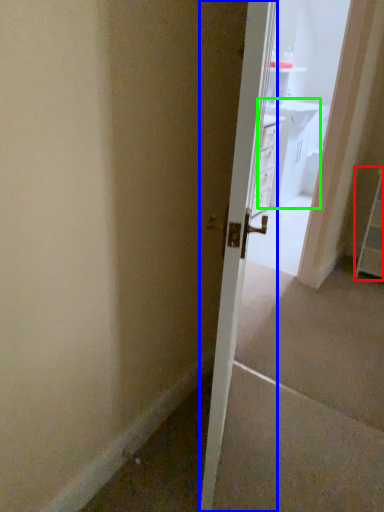
Question: Which is farther away from dresser (highlighted by a red box)? door (highlighted by a blue box) or vanity (highlighted by a green box)?

Choices:
 (A) door
 (B) vanity

Answer: (B)